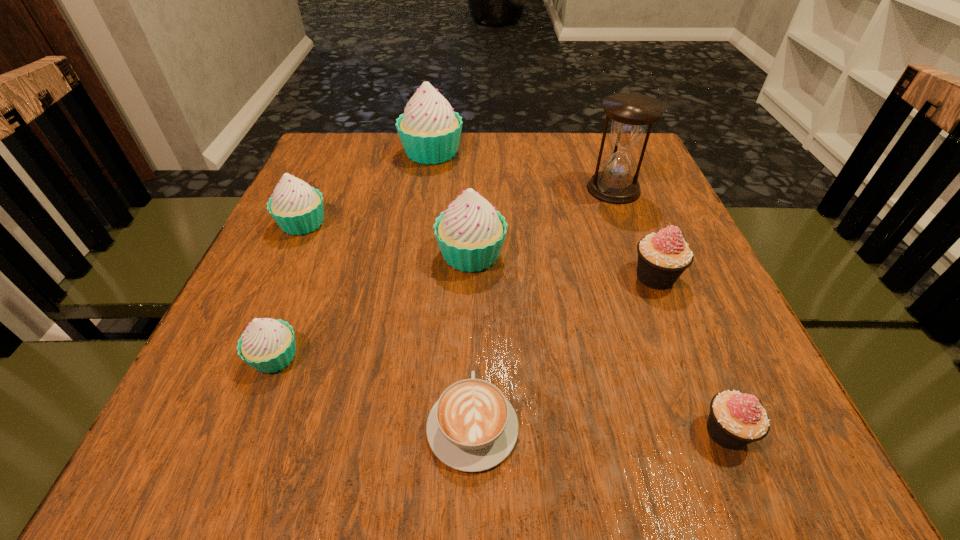
You are a GUI agent. You are given a task and a screenshot of the screen. Output one action in this format:
    pyautogui.click(x=<x>, y=<y>)
    Task: Click on the smaller pink cupcake
    This screenshot has height=540, width=960.
    Given the screenshot: What is the action you would take?
    pyautogui.click(x=736, y=419)

This screenshot has height=540, width=960. Identify the location of the shortest object. click(472, 427).

You are a GUI agent. You are given a task and a screenshot of the screen. Output one action in this format:
    pyautogui.click(x=<x>, y=<y>)
    Task: Click on the vacant space situated on the front of the hourglass
    Image resolution: width=960 pixels, height=540 pixels.
    Given the screenshot: What is the action you would take?
    [x=634, y=242]

You are a GUI agent. You are given a task and a screenshot of the screen. Output one action in this format:
    pyautogui.click(x=<x>, y=<y>)
    Task: Click on the free region located on the right of the farthest object
    
    Given the screenshot: What is the action you would take?
    click(x=603, y=153)

This screenshot has width=960, height=540. What are the coordinates of `vacant space located 0.330m on the back of the second biggest white cupcake` in the screenshot? It's located at (473, 151).

Locate an element on the screen. The image size is (960, 540). free region located 0.050m on the right of the second smallest white cupcake is located at coordinates (352, 223).

Locate an element on the screen. The image size is (960, 540). free space located 0.280m on the front of the bigger pink cupcake is located at coordinates (724, 450).

Identify the location of free space located 0.160m on the back of the smallest white cupcake. The height and width of the screenshot is (540, 960). (310, 268).

Find the location of `free space located 0.200m on the back of the smaller pink cupcake`. free space located 0.200m on the back of the smaller pink cupcake is located at coordinates [673, 303].

Locate an element on the screen. This screenshot has width=960, height=540. vacant space located on the side of the shortest object with the handle is located at coordinates (473, 341).